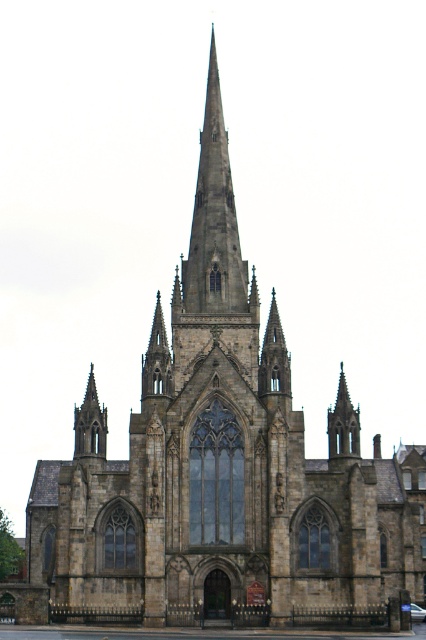
Which is in front, point (100, 440) or point (342, 454)?

Point (342, 454)

Does point (94, 438) come behind point (331, 454)?

That is True.

You are a GUI agent. You are given a task and a screenshot of the screen. Output one action in this format:
    pyautogui.click(x=<x>, y=<y>)
    Task: Click on the brown stone spire at lower left
    
    Given the screenshot: What is the action you would take?
    pyautogui.click(x=89, y=422)

Between point (271, 369) and point (163, 360), which one is positioned behind?

Point (163, 360)

Is point (276, 326) closer to camera compared to point (160, 396)?

No, it is behind (160, 396).

Does point (268, 317) lie in front of point (164, 333)?

No, it is behind (164, 333).

You are a GUI agent. You are given a task and a screenshot of the screen. Output one action in this format:
    pyautogui.click(x=<x>, y=<y>)
    Task: Click on the dark brown stone spire at center
    The image size is (426, 640).
    Given the screenshot: What is the action you would take?
    pyautogui.click(x=275, y=362)

Can you confirm if dark gray stone spire at center is positioned above dark brown stone spire at upper center?

Indeed, dark gray stone spire at center is positioned over dark brown stone spire at upper center.

Image resolution: width=426 pixels, height=640 pixels. What do you see at coordinates (157, 358) in the screenshot?
I see `dark gray stone spire at center` at bounding box center [157, 358].

Is point (157, 378) closer to camera compared to point (348, 433)?

Yes, point (157, 378) is closer to viewer.

Where is `dark gray stone spire at center`? dark gray stone spire at center is located at coordinates (157, 358).